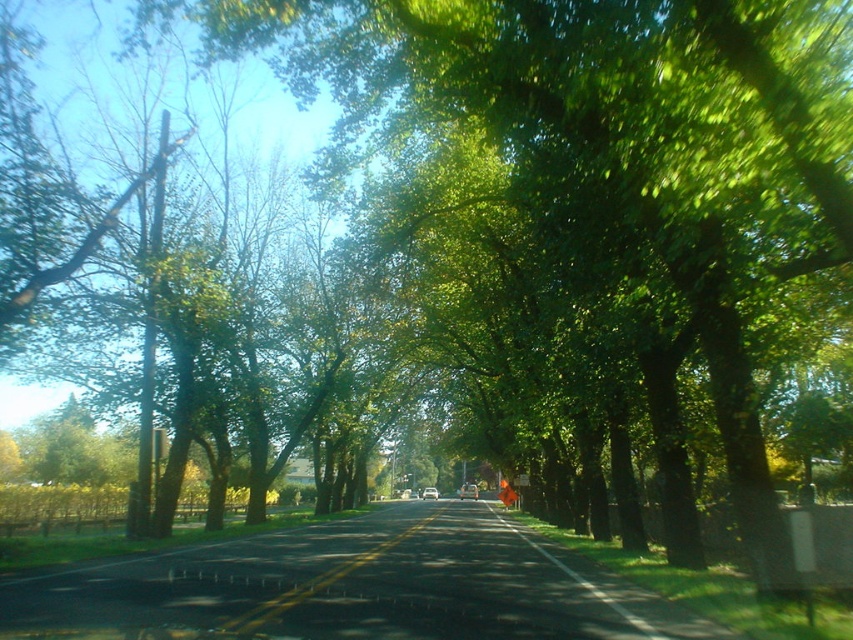
You are standing at the starting point of the road and want to reach a destination located at point (x=433, y=490). However, there is an obstacle at point (x=341, y=564). Which point should you avoid to reach your destination safely?

You should avoid the point (x=341, y=564) because it is closer to you than the destination point (x=433, y=490), so the obstacle there would block your path.

You are standing at the starting point of the road and want to take a photo of the green leafy tree at center. Where should you position yourself to capture it in the frame?

The green leafy tree at center is located at point (587, 584), so you should position yourself at that coordinate to capture it in the frame.

You are standing at the camera position and want to cross the yellow asphalt road at center. The road is 6.59 meters wide. If you can walk 1.5 meters per second, how many seconds will it take you to cross the road safely?

The yellow asphalt road at center is 6.59 meters from camera. To cross it safely at 1.5 meters per second, it would take approximately 4.4 seconds.